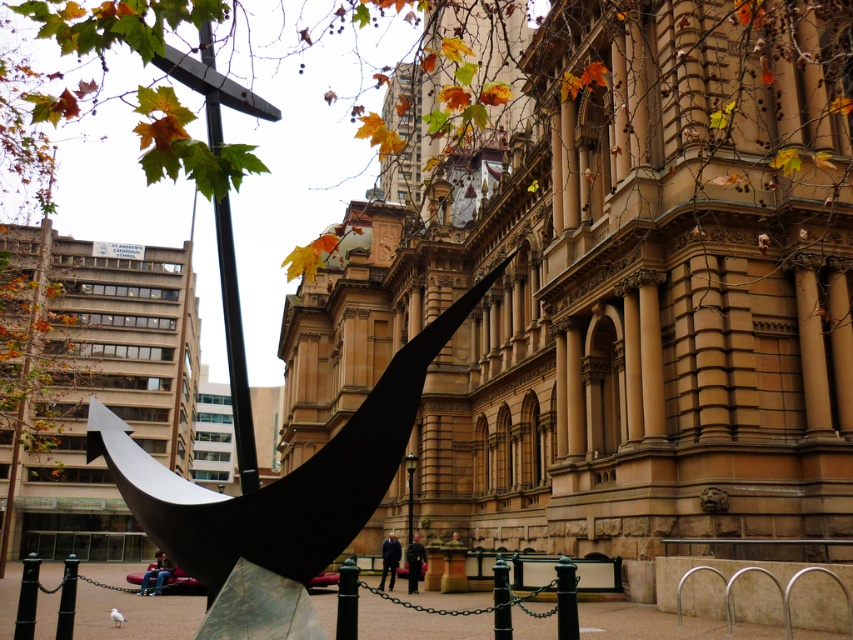
You are an urban planner assessing the placement of the polished black sculpture at center and the metallic pole at upper center in the image. Considering their sizes, which object would likely require more space for maintenance access?

The polished black sculpture at center has a larger size compared to the metallic pole at upper center, so it would likely require more space for maintenance access.

You are an urban planner assessing the placement of two metallic poles in the city square. The poles are labeled as the metallic pole at upper center and the metallic pole at center. Based on the scene description, which pole would cast a longer shadow during midday when the sun is directly overhead?

The metallic pole at upper center is bigger than the metallic pole at center, so it would cast a longer shadow during midday when the sun is directly overhead.

You are an urban planner assessing the placement of two metallic poles in the city square. The poles are labeled as the metallic pole at upper center and the metallic pole at center. Based on the scene description, which pole is located higher up in the image?

The metallic pole at upper center is positioned over the metallic pole at center, meaning it is higher up in the image.